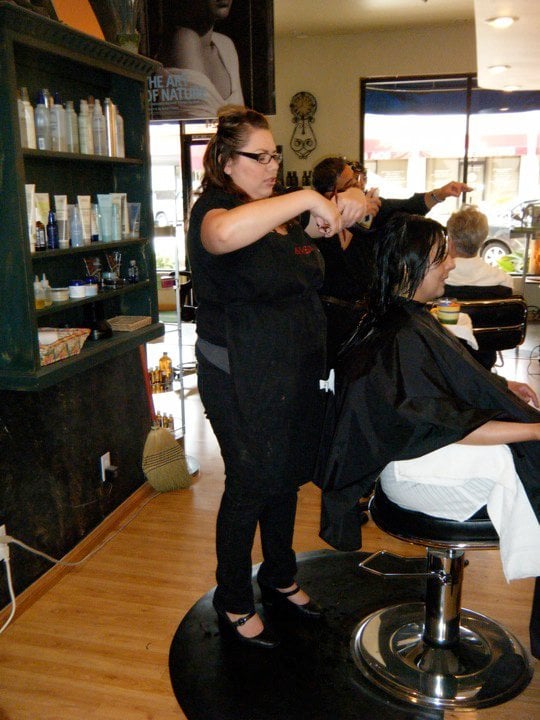
At what (x,y) coordinates should I click in order to perform the action: click on window. Please return your answer as a coordinate pair (x, y). Looking at the image, I should click on (427, 163), (171, 160).